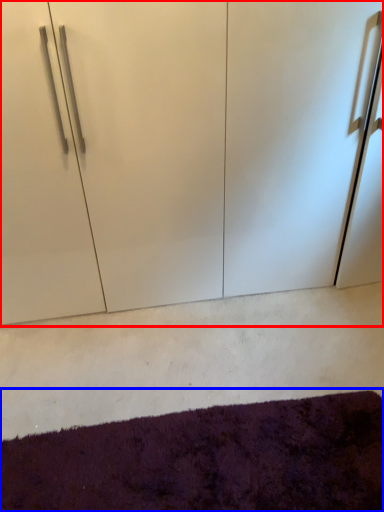
Question: Which point is closer to the camera, cupboard (highlighted by a red box) or mat (highlighted by a blue box)?

Choices:
 (A) cupboard
 (B) mat

Answer: (B)